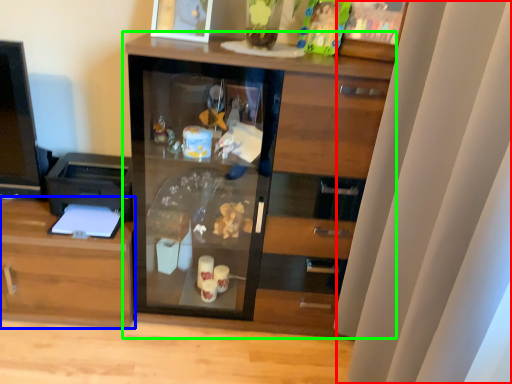
Question: Considering the real-world distances, which object is farthest from curtain (highlighted by a red box)? cabinetry (highlighted by a blue box) or cupboard (highlighted by a green box)?

Choices:
 (A) cabinetry
 (B) cupboard

Answer: (A)